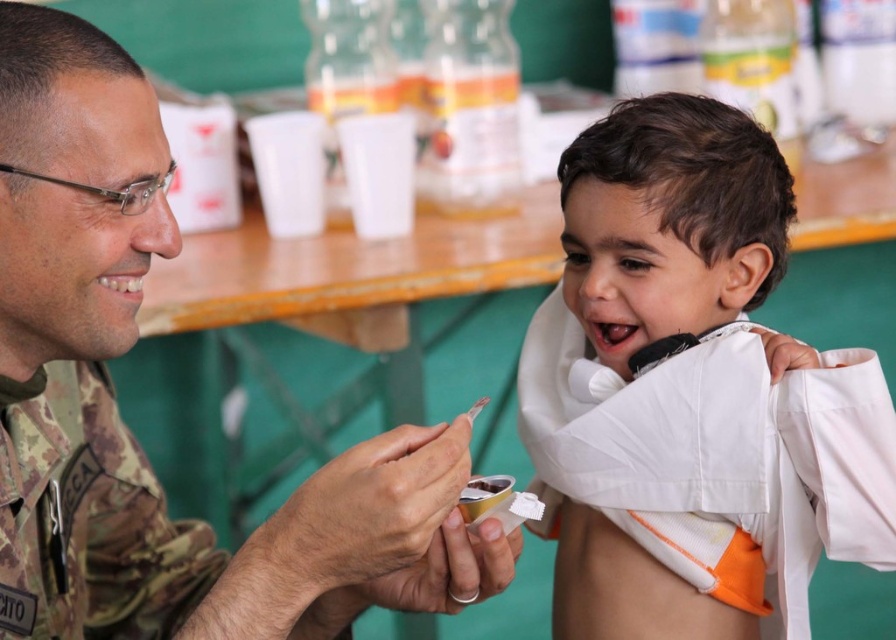
You are a healthcare worker observing the scene. You see the white cotton shirt at center and the camo fabric uniform at left. Which clothing item is positioned higher in the image?

The white cotton shirt at center is located above the camo fabric uniform at left, so it is positioned higher in the image.

In the scene shown: You are a healthcare professional in a clinic. You need to place a 12 inch long medical tool between the white cotton shirt at center and the camouflage uniform at left. Is there enough space between them to fit the tool?

The distance between the white cotton shirt at center and the camouflage uniform at left is 14.44 inches. Since the medical tool is 12 inches long, there is sufficient space to place it between them.